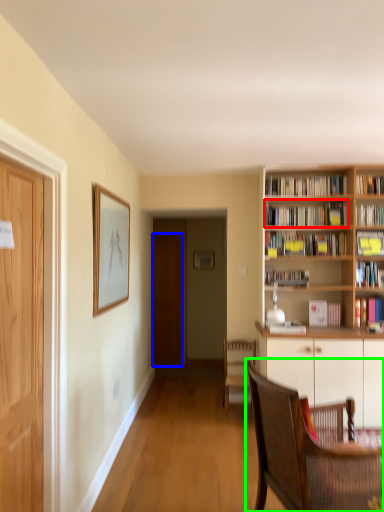
Question: Which is nearer to the book (highlighted by a red box)? door (highlighted by a blue box) or chair (highlighted by a green box).

Choices:
 (A) door
 (B) chair

Answer: (B)